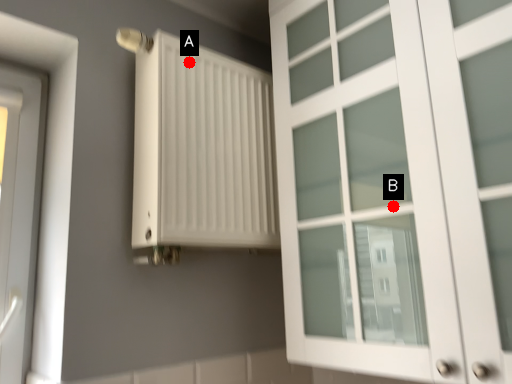
Question: Two points are circled on the image, labeled by A and B beside each circle. Which point appears farthest from the camera in this image?

Choices:
 (A) A is further
 (B) B is further

Answer: (A)